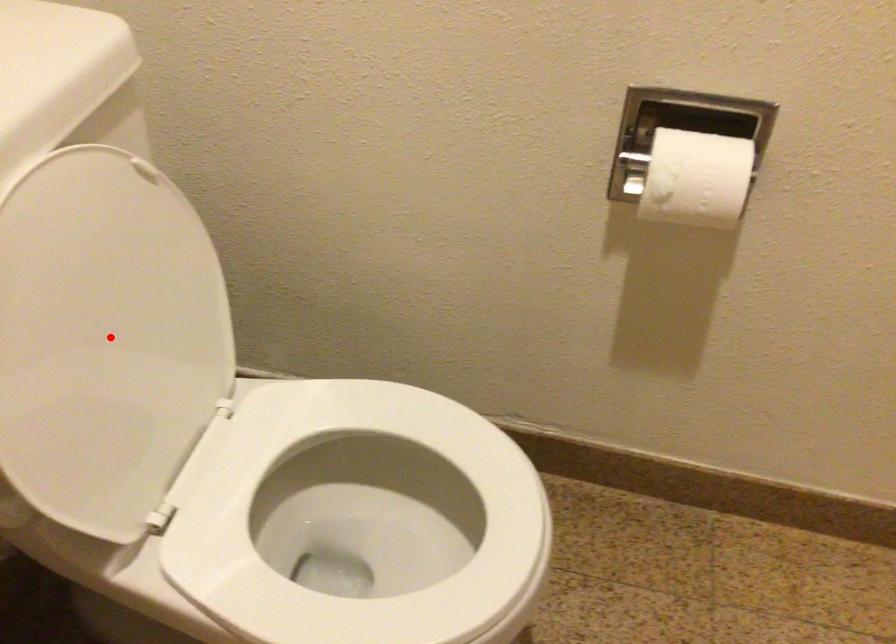
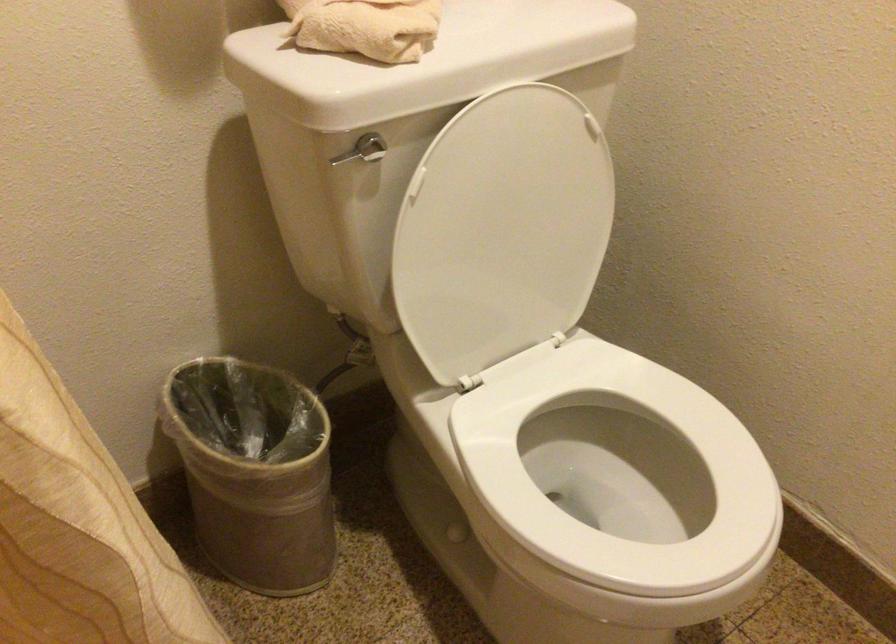
Question: I am providing you with two images of the same scene from different viewpoints. Image1 has a red point marked. In image2, the corresponding 3D location appears at what relative position? Reply with the corresponding letter.

Choices:
 (A) Closer
 (B) Farther

Answer: (B)